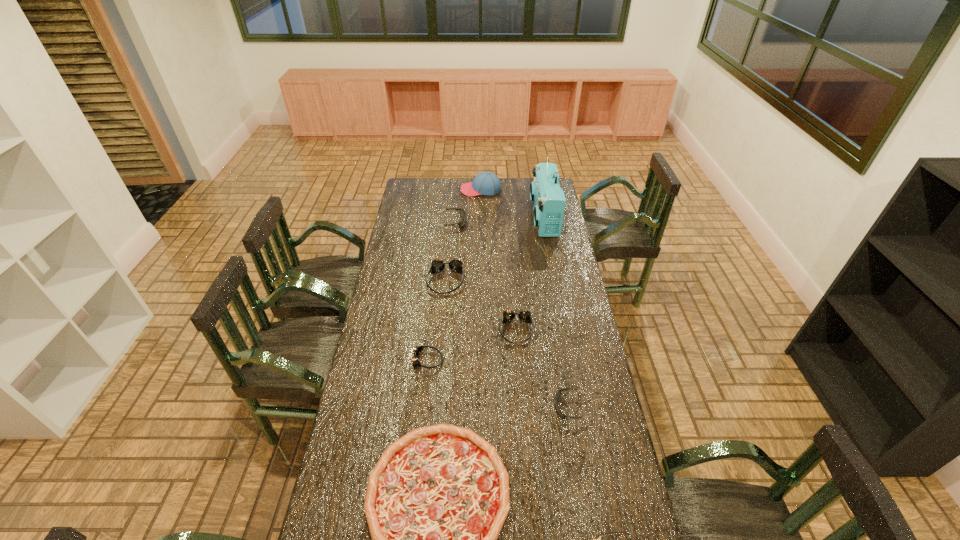
Identify the location of radio receiver. (548, 198).

What are the coordinates of `blue radio receiver` in the screenshot? It's located at (548, 198).

At what (x,y) coordinates should I click in order to perform the action: click on blue baseball cap. Please return your answer as a coordinate pair (x, y). The width and height of the screenshot is (960, 540). Looking at the image, I should click on (487, 183).

Where is `the second tallest object`? The height and width of the screenshot is (540, 960). the second tallest object is located at coordinates (487, 183).

Identify the location of the biggest bronze goggles. tap(455, 264).

I want to click on the seventh shortest object, so tap(455, 264).

This screenshot has height=540, width=960. I want to click on the second smallest bronze goggles, so click(x=524, y=315).

Identify the location of the rightmost bronze goggles. The height and width of the screenshot is (540, 960). (524, 315).

The image size is (960, 540). In order to click on the farther black goggles in this screenshot , I will do `click(462, 213)`.

Find the location of `the farthest goggles`. the farthest goggles is located at coordinates (462, 213).